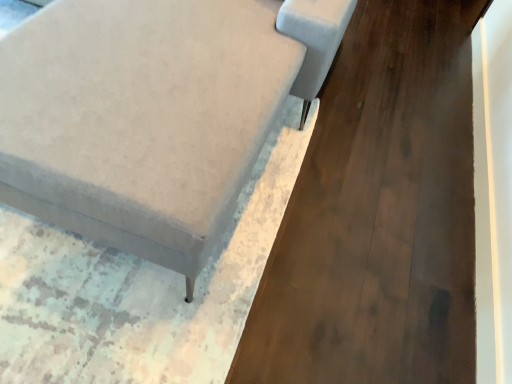
This screenshot has width=512, height=384. Find the location of `velvet gray sofa at lower left`. velvet gray sofa at lower left is located at coordinates (152, 113).

This screenshot has width=512, height=384. What do you see at coordinates (152, 113) in the screenshot?
I see `velvet gray sofa at lower left` at bounding box center [152, 113].

Locate an element on the screen. velvet gray sofa at lower left is located at coordinates tap(152, 113).